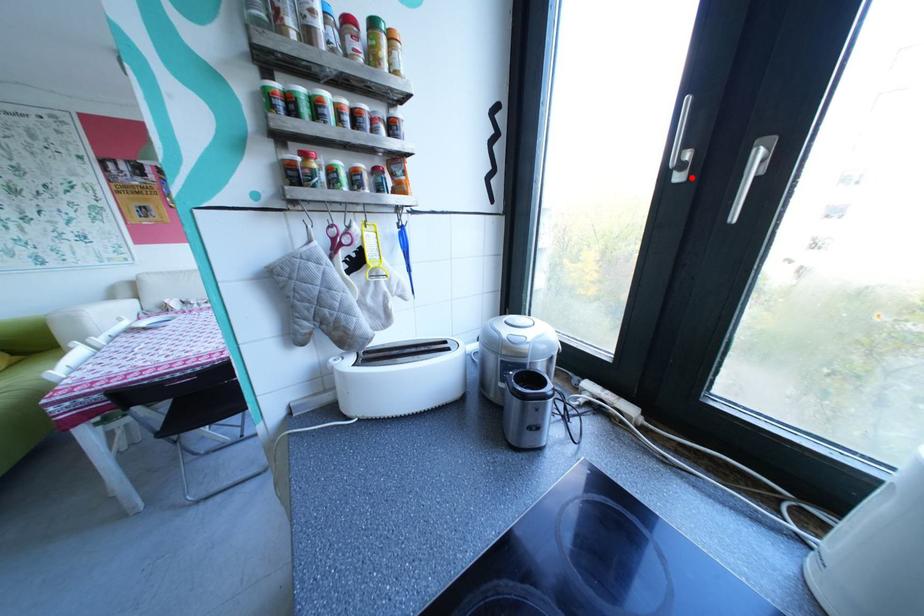
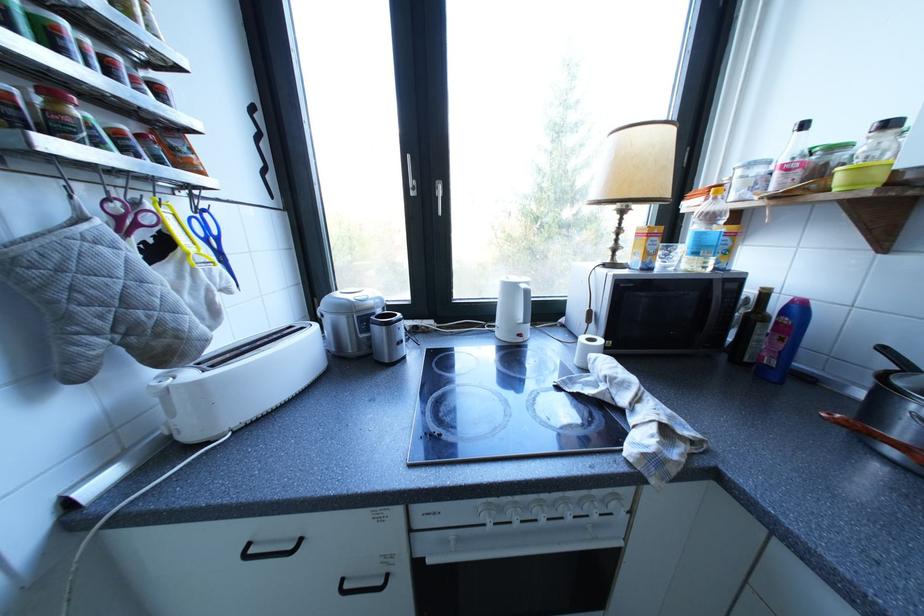
In the second image, find the point that corresponds to the highlighted location in the first image.

(426, 193)